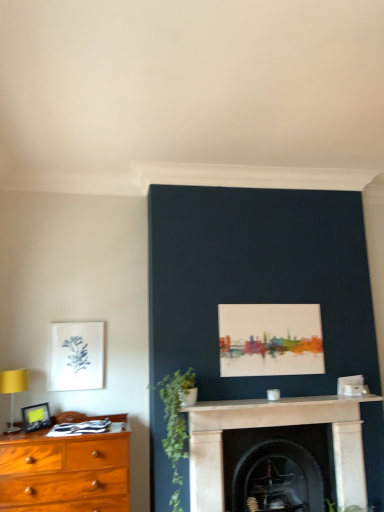
Measure the distance between point (171, 412) and camera.

They are 3.05 meters apart.

Measure the distance between white marble fireplace at center, which appears as the 2th fireplace when viewed from the back, and camera.

white marble fireplace at center, which appears as the 2th fireplace when viewed from the back, is 9.97 feet from camera.

What do you see at coordinates (13, 390) in the screenshot? Image resolution: width=384 pixels, height=512 pixels. I see `yellow fabric lampshade at left` at bounding box center [13, 390].

The height and width of the screenshot is (512, 384). What do you see at coordinates (283, 403) in the screenshot? I see `white marble mantle at center` at bounding box center [283, 403].

What are the coordinates of `matte white picture frame at left, which is the 1th picture frame in top-to-bottom order` in the screenshot? It's located at (76, 356).

At what (x,y) coordinates should I click in order to perform the action: click on green matte plant at center-left. Please return your answer as a coordinate pair (x, y). Image resolution: width=384 pixels, height=512 pixels. Looking at the image, I should click on (176, 423).

Image resolution: width=384 pixels, height=512 pixels. What are the coordinates of `mantle directly beneath the yellow fabric lampshade at left (from a real-world perspective)` in the screenshot? It's located at (283, 403).

From the image's perspective, which one is positioned higher, white marble mantle at center or yellow fabric lampshade at left?

yellow fabric lampshade at left is shown above in the image.

Which object is wider, white marble mantle at center or yellow fabric lampshade at left?

Wider between the two is yellow fabric lampshade at left.

From the image's perspective, is green matte plant at center-left on top of yellow fabric lampshade at left?

No, from the image's perspective, green matte plant at center-left is not above yellow fabric lampshade at left.

Is green matte plant at center-left next to yellow fabric lampshade at left and touching it?

No, green matte plant at center-left is not next to yellow fabric lampshade at left.

How different are the orientations of green matte plant at center-left and yellow fabric lampshade at left in degrees?

They differ by 0.0731 degrees in their facing directions.

Consider the image. From a real-world perspective, which is physically below, green matte plant at center-left or yellow fabric lampshade at left?

green matte plant at center-left, from a real-world perspective.

Does matte black picture frame at left, arranged as the second picture frame when viewed from the back, touch matte white picture frame at left, which is the 1th picture frame in top-to-bottom order?

No.

Which object is positioned more to the left, matte black picture frame at left, the 2th picture frame when ordered from top to bottom, or matte white picture frame at left, which is the 1th picture frame in top-to-bottom order?

Positioned to the left is matte black picture frame at left, the 2th picture frame when ordered from top to bottom.

Between matte black picture frame at left, which is the 1th picture frame from front to back, and matte white picture frame at left, which is the 1th picture frame in top-to-bottom order, which one is positioned in front?

matte black picture frame at left, which is the 1th picture frame from front to back, is more forward.

Between point (285, 434) and point (254, 399), which one is positioned in front?

Positioned in front is point (254, 399).

In terms of width, does dark stone fireplace at center, placed as the second fireplace when sorted from front to back, look wider or thinner when compared to white marble mantle at center?

Considering their sizes, dark stone fireplace at center, placed as the second fireplace when sorted from front to back, looks broader than white marble mantle at center.

Consider the image. How many degrees apart are the facing directions of dark stone fireplace at center, placed as the second fireplace when sorted from front to back, and white marble mantle at center?

They differ by 1.57 degrees in their facing directions.

Does dark stone fireplace at center, which ranks as the first fireplace in back-to-front order, come behind white marble mantle at center?

Yes, dark stone fireplace at center, which ranks as the first fireplace in back-to-front order, is further from the viewer.

Which object is thinner, white marble fireplace at center, marked as the first fireplace in a front-to-back arrangement, or dark stone fireplace at center, placed as the second fireplace when sorted from front to back?

white marble fireplace at center, marked as the first fireplace in a front-to-back arrangement, is thinner.

Is white marble fireplace at center, which appears as the 2th fireplace when viewed from the back, next to dark stone fireplace at center, which ranks as the first fireplace in back-to-front order, and touching it?

No, white marble fireplace at center, which appears as the 2th fireplace when viewed from the back, is not next to dark stone fireplace at center, which ranks as the first fireplace in back-to-front order.

At what (x,y) coordinates should I click in order to perform the action: click on fireplace lying in front of the dark stone fireplace at center, which ranks as the first fireplace in back-to-front order. Please return your answer as a coordinate pair (x, y). Image resolution: width=384 pixels, height=512 pixels. Looking at the image, I should click on (275, 426).

In the scene shown: What's the angular difference between white marble fireplace at center, marked as the first fireplace in a front-to-back arrangement, and dark stone fireplace at center, which ranks as the first fireplace in back-to-front order,'s facing directions?

white marble fireplace at center, marked as the first fireplace in a front-to-back arrangement, and dark stone fireplace at center, which ranks as the first fireplace in back-to-front order, are facing 2.11 degrees away from each other.

Is green matte plant at center-left not near matte black picture frame at left, which is the 1th picture frame from front to back?

No, there isn't a large distance between green matte plant at center-left and matte black picture frame at left, which is the 1th picture frame from front to back.

Does green matte plant at center-left have a lesser height compared to matte black picture frame at left, the 2th picture frame when ordered from top to bottom?

In fact, green matte plant at center-left may be taller than matte black picture frame at left, the 2th picture frame when ordered from top to bottom.

Considering the relative positions of green matte plant at center-left and matte black picture frame at left, which is the 1th picture frame from front to back, in the image provided, is green matte plant at center-left to the left or to the right of matte black picture frame at left, which is the 1th picture frame from front to back,?

green matte plant at center-left is to the right of matte black picture frame at left, which is the 1th picture frame from front to back.

Does point (192, 385) lie behind point (46, 417)?

No, (192, 385) is in front of (46, 417).

At what (x,y) coordinates should I click in order to perform the action: click on table lamp above the dark stone fireplace at center, placed as the second fireplace when sorted from front to back (from a real-world perspective). Please return your answer as a coordinate pair (x, y). Image resolution: width=384 pixels, height=512 pixels. Looking at the image, I should click on (13, 390).

Is the position of dark stone fireplace at center, which ranks as the first fireplace in back-to-front order, more distant than that of yellow fabric lampshade at left?

Yes, dark stone fireplace at center, which ranks as the first fireplace in back-to-front order, is further from the viewer.

Can we say dark stone fireplace at center, placed as the second fireplace when sorted from front to back, lies outside yellow fabric lampshade at left?

Yes, dark stone fireplace at center, placed as the second fireplace when sorted from front to back, is located beyond the bounds of yellow fabric lampshade at left.

From the picture: From the image's perspective, between dark stone fireplace at center, placed as the second fireplace when sorted from front to back, and yellow fabric lampshade at left, which one is located above?

yellow fabric lampshade at left is shown above in the image.

Locate an element on the screen. The width and height of the screenshot is (384, 512). mantle on the right of yellow fabric lampshade at left is located at coordinates pyautogui.click(x=283, y=403).

At what (x,y) coordinates should I click in order to perform the action: click on table lamp behind the green matte plant at center-left. Please return your answer as a coordinate pair (x, y). This screenshot has width=384, height=512. Looking at the image, I should click on (13, 390).

Based on their spatial positions, is dark stone fireplace at center, which ranks as the first fireplace in back-to-front order, or matte white picture frame at left, acting as the 1th picture frame starting from the back, closer to white marble fireplace at center, marked as the first fireplace in a front-to-back arrangement?

dark stone fireplace at center, which ranks as the first fireplace in back-to-front order, lies closer to white marble fireplace at center, marked as the first fireplace in a front-to-back arrangement, than the other object.

From the image, which object appears to be nearer to yellow fabric lampshade at left, green matte plant at center-left or white marble fireplace at center, marked as the first fireplace in a front-to-back arrangement?

green matte plant at center-left is positioned closer to the anchor yellow fabric lampshade at left.

Which object lies nearer to the anchor point matte white picture frame at left, acting as the 1th picture frame starting from the back, green matte plant at center-left or white marble mantle at center?

Based on the image, green matte plant at center-left appears to be nearer to matte white picture frame at left, acting as the 1th picture frame starting from the back.

Estimate the real-world distances between objects in this image. Which object is closer to dark stone fireplace at center, placed as the second fireplace when sorted from front to back, yellow fabric lampshade at left or matte white picture frame at left, which is the 1th picture frame in top-to-bottom order?

Based on the image, matte white picture frame at left, which is the 1th picture frame in top-to-bottom order, appears to be nearer to dark stone fireplace at center, placed as the second fireplace when sorted from front to back.

Looking at this image, considering their positions, is matte black picture frame at left, the 2th picture frame when ordered from top to bottom, positioned further to dark stone fireplace at center, which ranks as the first fireplace in back-to-front order, than matte white picture frame at left, acting as the 1th picture frame starting from the back?

matte black picture frame at left, the 2th picture frame when ordered from top to bottom, lies further to dark stone fireplace at center, which ranks as the first fireplace in back-to-front order, than the other object.

Considering their positions, is matte white picture frame at left, the second picture frame positioned from the front, positioned closer to yellow fabric lampshade at left than white marble mantle at center?

The object closer to yellow fabric lampshade at left is matte white picture frame at left, the second picture frame positioned from the front.

Based on their spatial positions, is green matte plant at center-left or yellow fabric lampshade at left closer to white marble fireplace at center, which appears as the 2th fireplace when viewed from the back?

Based on the image, green matte plant at center-left appears to be nearer to white marble fireplace at center, which appears as the 2th fireplace when viewed from the back.

Estimate the real-world distances between objects in this image. Which object is further from yellow fabric lampshade at left, green matte plant at center-left or white marble mantle at center?

Among the two, white marble mantle at center is located further to yellow fabric lampshade at left.

Find the location of a particular element. The height and width of the screenshot is (512, 384). plant between yellow fabric lampshade at left and white marble fireplace at center, which appears as the 2th fireplace when viewed from the back, from left to right is located at coordinates click(x=176, y=423).

In order to click on picture frame located between matte black picture frame at left, which is the 1th picture frame from bottom to top, and green matte plant at center-left in the left-right direction in this screenshot , I will do `click(76, 356)`.

Where is `fireplace between white marble mantle at center and dark stone fireplace at center, which ranks as the first fireplace in back-to-front order, vertically`? Image resolution: width=384 pixels, height=512 pixels. fireplace between white marble mantle at center and dark stone fireplace at center, which ranks as the first fireplace in back-to-front order, vertically is located at coordinates (275, 426).

Where is `picture frame between yellow fabric lampshade at left and matte white picture frame at left, the second picture frame positioned from the bottom, along the z-axis`? This screenshot has width=384, height=512. picture frame between yellow fabric lampshade at left and matte white picture frame at left, the second picture frame positioned from the bottom, along the z-axis is located at coordinates [36, 417].